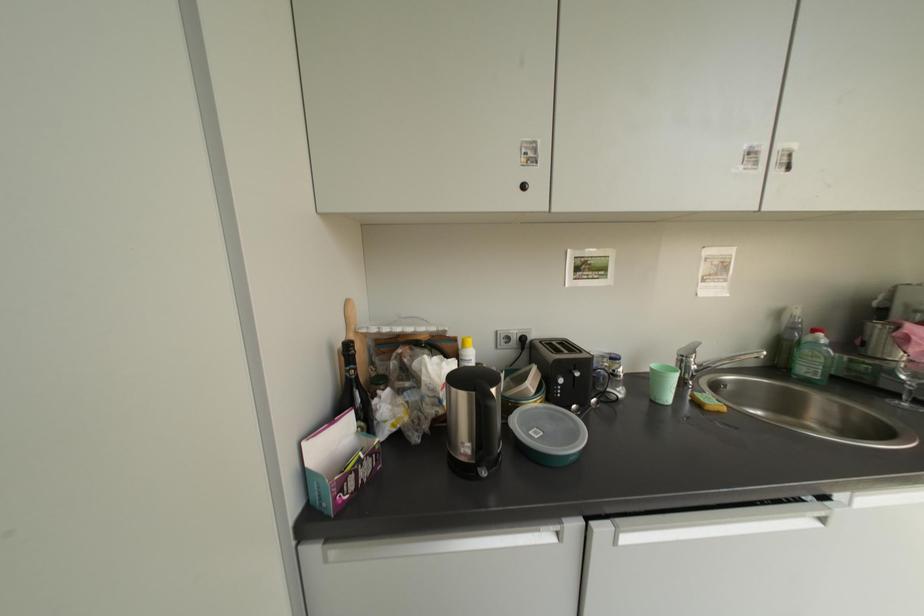
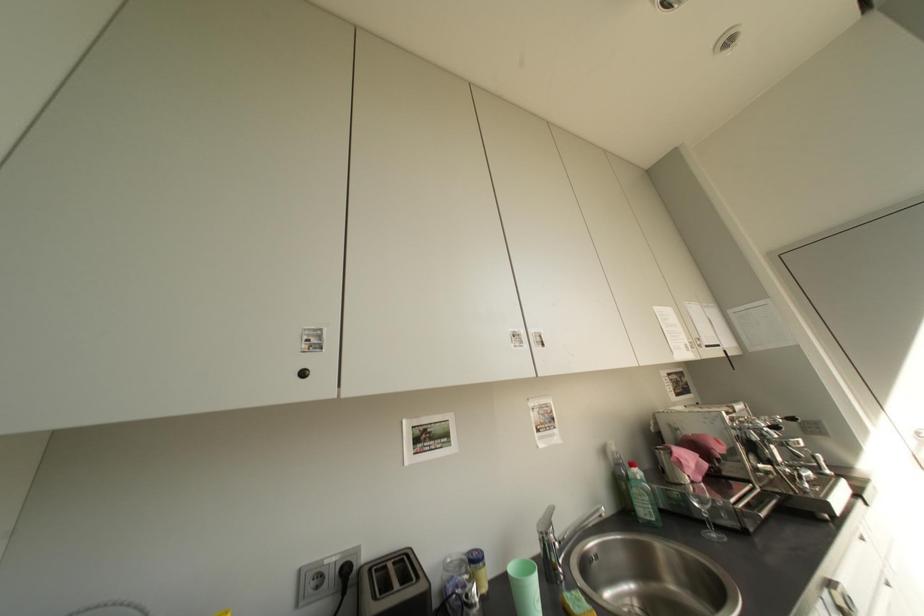
The first image is from the beginning of the video and the second image is from the end. How did the camera likely rotate when shooting the video?

The camera's rotation is toward right-up.